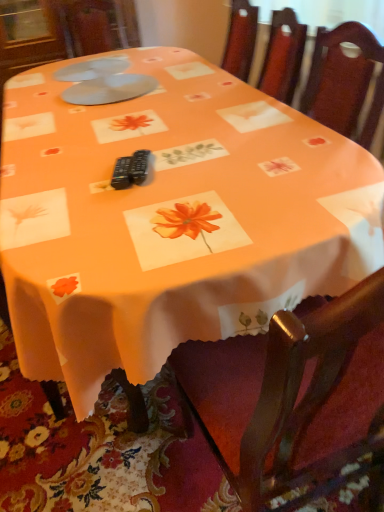
Question: Would you say white plastic plates at upper center, the 2th tableware from the front, is inside or outside matte plastic plates at upper center, marked as the 2th tableware in a back-to-front arrangement?

Choices:
 (A) inside
 (B) outside

Answer: (B)

Question: From a real-world perspective, is white plastic plates at upper center, the 2th tableware from the front, above or below matte plastic plates at upper center, the first tableware positioned from the front?

Choices:
 (A) above
 (B) below

Answer: (A)

Question: Relative to matte plastic plates at upper center, marked as the 2th tableware in a back-to-front arrangement, is white plastic plates at upper center, the 2th tableware from the front, in front or behind?

Choices:
 (A) behind
 (B) front

Answer: (A)

Question: In terms of width, does matte plastic plates at upper center, marked as the 2th tableware in a back-to-front arrangement, look wider or thinner when compared to white plastic plates at upper center, the 2th tableware from the front?

Choices:
 (A) thin
 (B) wide

Answer: (B)

Question: Does point (92, 104) appear closer or farther from the camera than point (74, 79)?

Choices:
 (A) closer
 (B) farther

Answer: (A)

Question: Is matte plastic plates at upper center, marked as the 2th tableware in a back-to-front arrangement, taller or shorter than white plastic plates at upper center, the 2th tableware from the front?

Choices:
 (A) short
 (B) tall

Answer: (B)

Question: Relative to white plastic plates at upper center, the 2th tableware from the front, is matte plastic plates at upper center, marked as the 2th tableware in a back-to-front arrangement, in front or behind?

Choices:
 (A) front
 (B) behind

Answer: (A)